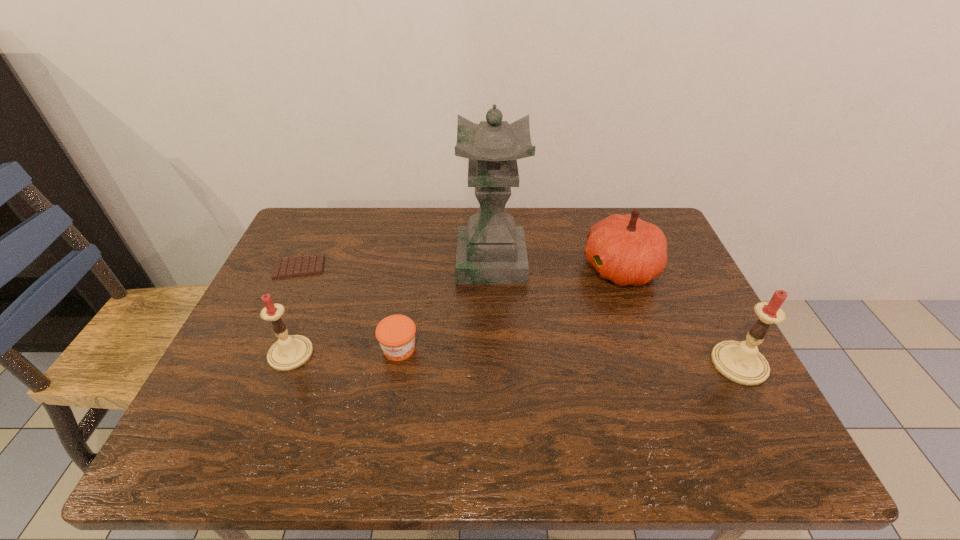
The width and height of the screenshot is (960, 540). What are the coordinates of `vacant space at the left edge of the desktop` in the screenshot? It's located at (290, 278).

At what (x,y) coordinates should I click in order to perform the action: click on free spot at the far left corner of the desktop. Please return your answer as a coordinate pair (x, y). Looking at the image, I should click on (351, 211).

This screenshot has height=540, width=960. Identify the location of vacant area that lies between the shorter candle and the second shortest object. (345, 352).

At what (x,y) coordinates should I click in order to perform the action: click on unoccupied area between the shorter candle and the taller candle. Please return your answer as a coordinate pair (x, y). Image resolution: width=960 pixels, height=540 pixels. Looking at the image, I should click on (515, 359).

Identify the location of vacant point located between the pumpkin and the fourth object from right to left. This screenshot has width=960, height=540. (510, 308).

At what (x,y) coordinates should I click in order to perform the action: click on free space between the left candle and the chocolate bar. Please return your answer as a coordinate pair (x, y). Looking at the image, I should click on click(x=295, y=310).

Locate an element on the screen. The image size is (960, 540). vacant space that is in between the chocolate bar and the tallest object is located at coordinates (395, 264).

The width and height of the screenshot is (960, 540). I want to click on empty space that is in between the pumpkin and the rightmost object, so click(x=680, y=316).

Image resolution: width=960 pixels, height=540 pixels. I want to click on free area in between the taller candle and the left candle, so click(x=515, y=359).

Where is `free spot between the sculpture and the rightmost object`? The image size is (960, 540). free spot between the sculpture and the rightmost object is located at coordinates (615, 313).